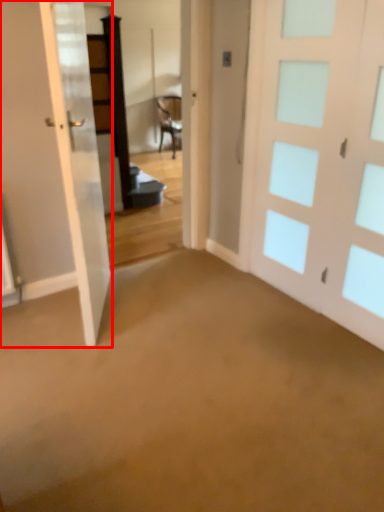
Question: From the image, what is the correct spatial relationship of door (annotated by the red box) in relation to door?

Choices:
 (A) left
 (B) right

Answer: (A)